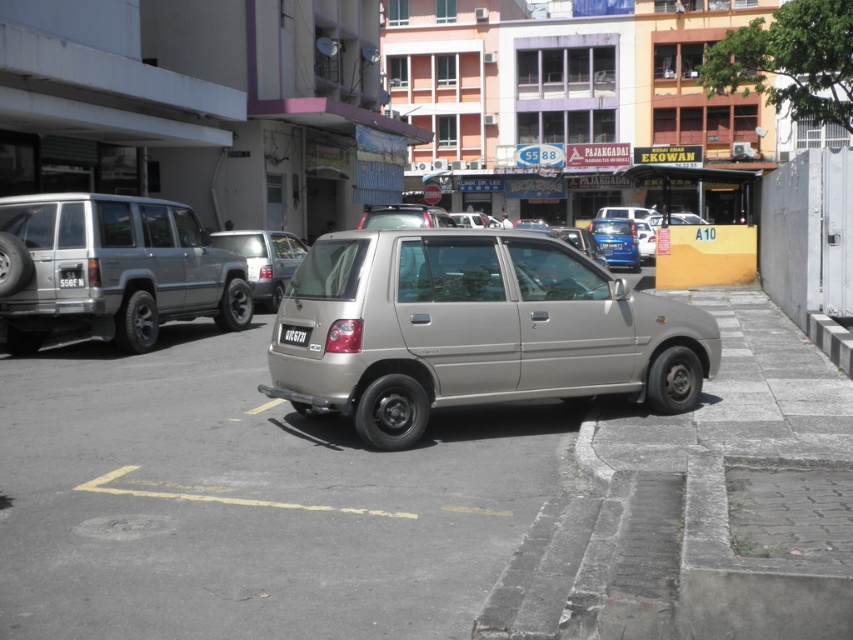
Is satin silver suv at center bigger than black plastic license plate at center?

Correct, satin silver suv at center is larger in size than black plastic license plate at center.

Is point (225, 241) positioned behind point (291, 339)?

Yes, it is.

The width and height of the screenshot is (853, 640). I want to click on satin silver suv at center, so click(x=263, y=260).

Identify the location of satin silver suv at center. (263, 260).

Is satin silver car at center closer to camera compared to satin silver suv at center?

Yes, satin silver car at center is closer to the viewer.

Who is higher up, satin silver car at center or satin silver suv at center?

satin silver suv at center is higher up.

I want to click on satin silver car at center, so click(x=473, y=330).

At what (x,y) coordinates should I click in order to perform the action: click on satin silver car at center. Please return your answer as a coordinate pair (x, y). This screenshot has width=853, height=640. Looking at the image, I should click on (473, 330).

Is satin silver minivan at left wider than black plastic license plate at center?

Indeed, satin silver minivan at left has a greater width compared to black plastic license plate at center.

Is satin silver minivan at left closer to camera compared to black plastic license plate at center?

No, it is behind black plastic license plate at center.

This screenshot has height=640, width=853. Find the location of `satin silver minivan at left`. satin silver minivan at left is located at coordinates 109,269.